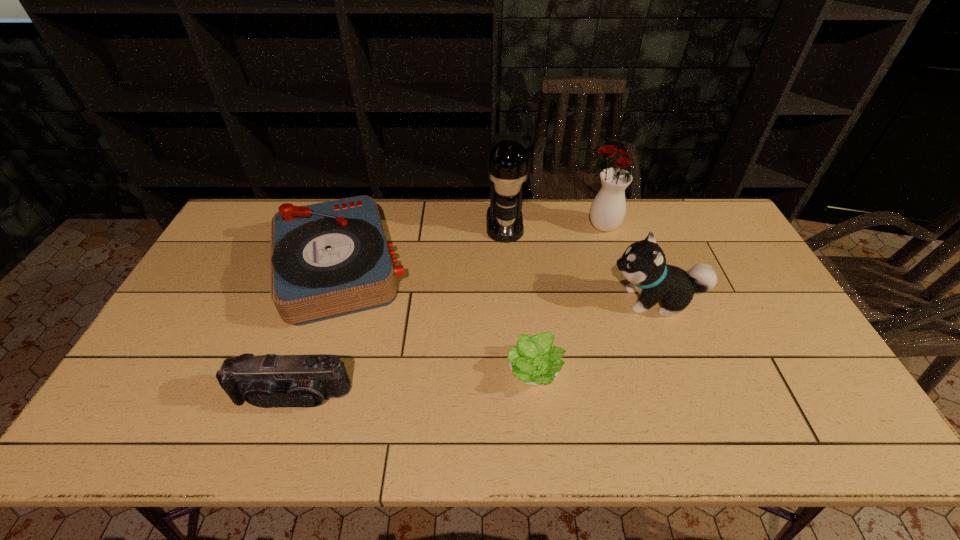
This screenshot has width=960, height=540. I want to click on vacant space located 0.330m at the face of the fourth shortest object, so click(493, 300).

In order to click on vacant space positioned 0.290m on the right of the record player in this screenshot , I will do `click(502, 268)`.

The height and width of the screenshot is (540, 960). What are the coordinates of `free region located 0.050m on the left of the shortest object` in the screenshot? It's located at (487, 373).

Image resolution: width=960 pixels, height=540 pixels. Identify the location of coffee maker that is positioned at the far edge. (508, 161).

Identify the location of vase that is at the far edge. The image size is (960, 540). (608, 208).

In order to click on record player that is at the far edge in this screenshot , I will do tap(331, 259).

I want to click on object that is at the near edge, so click(266, 381).

In the image, there is a desktop. In order to click on vacant region at the far edge in this screenshot , I will do `click(391, 204)`.

Find the location of `vacant area at the near edge`. vacant area at the near edge is located at coordinates (298, 428).

You are a GUI agent. You are given a task and a screenshot of the screen. Output one action in this format:
    pyautogui.click(x=<x>, y=<y>)
    Task: Click on the vacant space at the left edge of the desktop
    The image size is (960, 540).
    Given the screenshot: What is the action you would take?
    pyautogui.click(x=202, y=372)